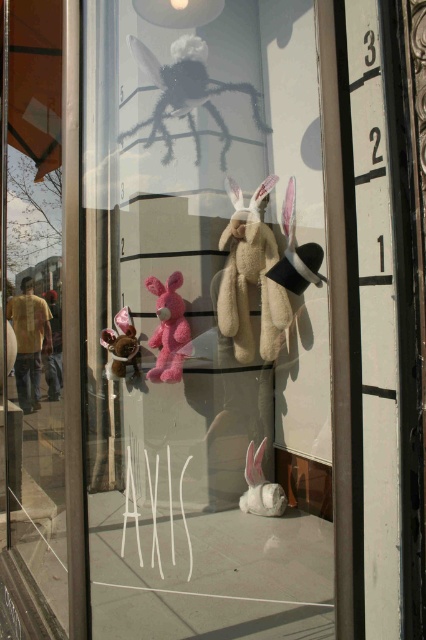
Question: Which is farther from the white plush rabbit at lower center?

Choices:
 (A) fuzzy black spider at upper center
 (B) velvet plush bear at left
 (C) beige plush rabbit at center
 (D) white plush rabbit at center

Answer: (A)

Question: Considering the real-world distances, which object is closest to the white plush rabbit at lower center?

Choices:
 (A) velvet plush bear at left
 (B) fuzzy black spider at upper center
 (C) white plush rabbit at center
 (D) pink fluffy stuffed rabbit at center

Answer: (D)

Question: Does fuzzy black spider at upper center appear on the right side of velvet plush bear at left?

Choices:
 (A) yes
 (B) no

Answer: (A)

Question: Which of the following is the farthest from the observer?

Choices:
 (A) velvet plush bear at left
 (B) pink fluffy stuffed rabbit at center
 (C) beige plush rabbit at center
 (D) white plush rabbit at lower center

Answer: (A)

Question: Can you confirm if pink fluffy stuffed rabbit at center is thinner than white plush rabbit at lower center?

Choices:
 (A) no
 (B) yes

Answer: (B)

Question: Is white plush rabbit at lower center to the left of velvet plush bear at left from the viewer's perspective?

Choices:
 (A) yes
 (B) no

Answer: (B)